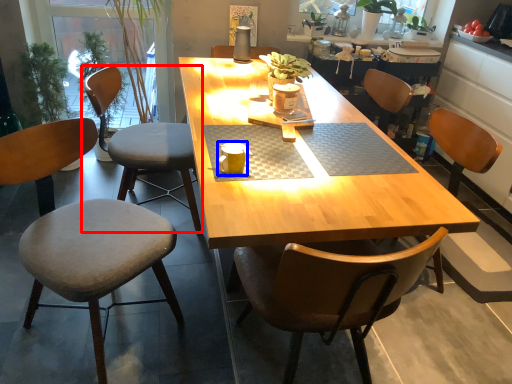
Question: Which point is closer to the camera, chair (highlighted by a red box) or coffee cup (highlighted by a blue box)?

Choices:
 (A) chair
 (B) coffee cup

Answer: (B)